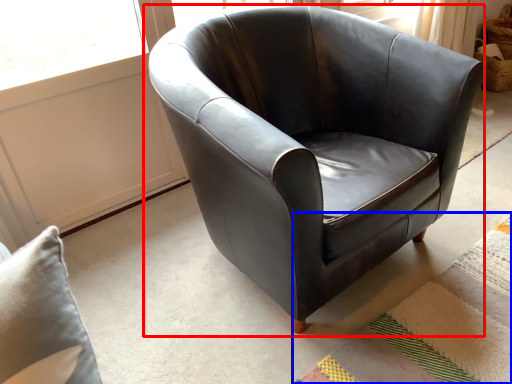
Question: Which object is further to the camera taking this photo, chair (highlighted by a red box) or mat (highlighted by a blue box)?

Choices:
 (A) chair
 (B) mat

Answer: (B)